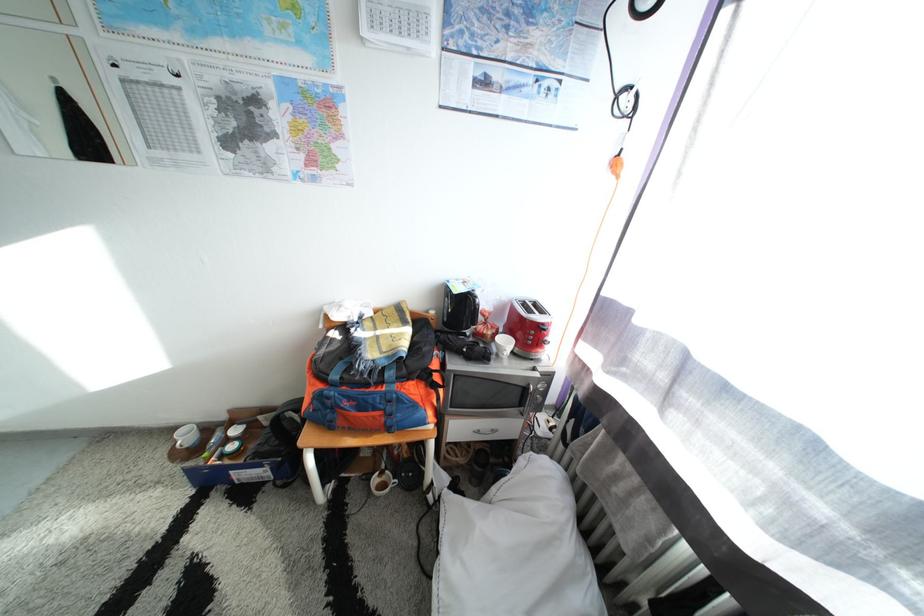
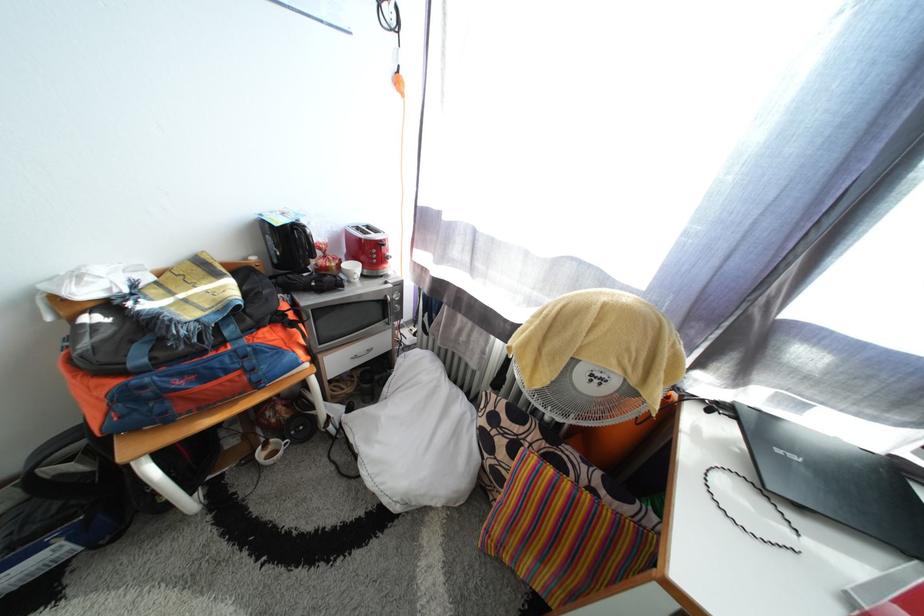
Where in the second image is the point corresponding to pixel 393 485 from the first image?

(280, 455)